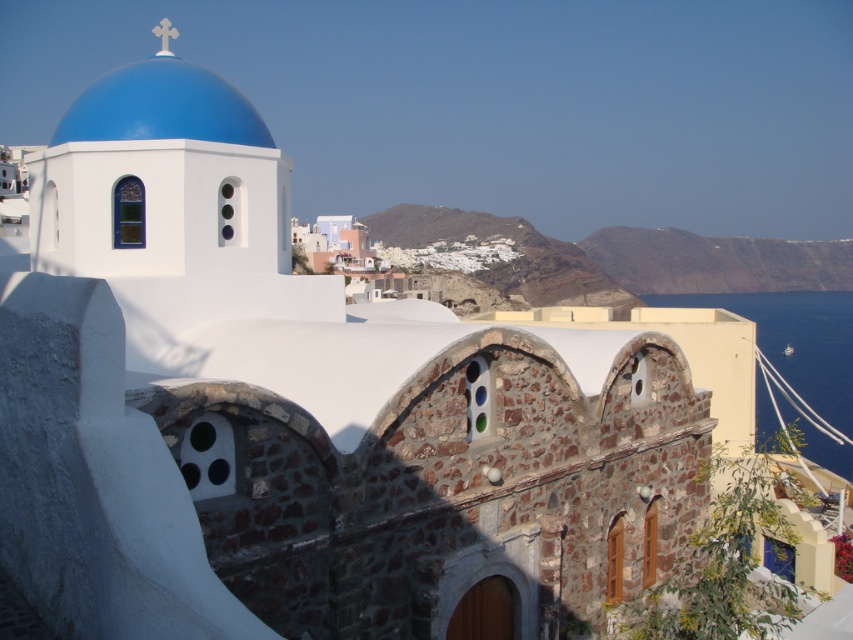
Question: Which point is closer to the camera taking this photo?

Choices:
 (A) (103, 84)
 (B) (838, 448)

Answer: (A)

Question: Is the position of blue water at right more distant than that of blue painted dome at upper left?

Choices:
 (A) yes
 (B) no

Answer: (A)

Question: Can you confirm if blue water at right is positioned to the left of blue painted dome at upper left?

Choices:
 (A) yes
 (B) no

Answer: (B)

Question: Does blue water at right appear on the left side of blue painted dome at upper left?

Choices:
 (A) yes
 (B) no

Answer: (B)

Question: Among these points, which one is nearest to the camera?

Choices:
 (A) (230, 106)
 (B) (840, 321)

Answer: (A)